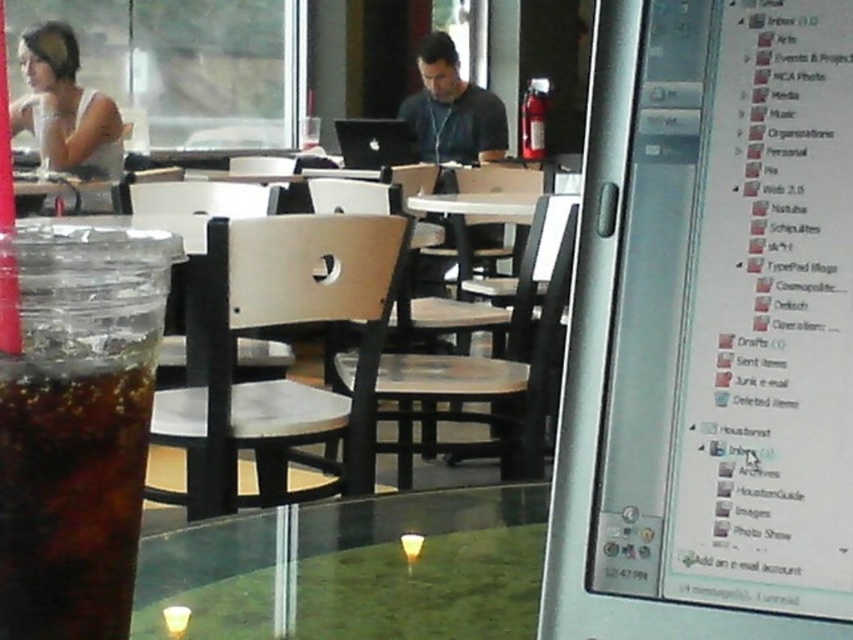
Question: Which is farther from the matte black shirt at center?

Choices:
 (A) silver metallic monitor at center right
 (B) dark brown liquid at lower left
 (C) matte white shirt at upper left

Answer: (B)

Question: Does transparent glass table at center appear under matte white shirt at upper left?

Choices:
 (A) yes
 (B) no

Answer: (A)

Question: Is transparent glass table at center smaller than dark brown liquid at lower left?

Choices:
 (A) no
 (B) yes

Answer: (A)

Question: Which point is farther from the camera taking this photo?

Choices:
 (A) (624, 49)
 (B) (102, 456)
 (C) (44, 102)
 (D) (196, 568)

Answer: (C)

Question: Can you confirm if dark brown liquid at lower left is wider than matte black shirt at center?

Choices:
 (A) no
 (B) yes

Answer: (A)

Question: Which object is closer to the camera taking this photo?

Choices:
 (A) silver metallic monitor at center right
 (B) matte white shirt at upper left
 (C) transparent glass table at center
 (D) dark brown liquid at lower left

Answer: (D)